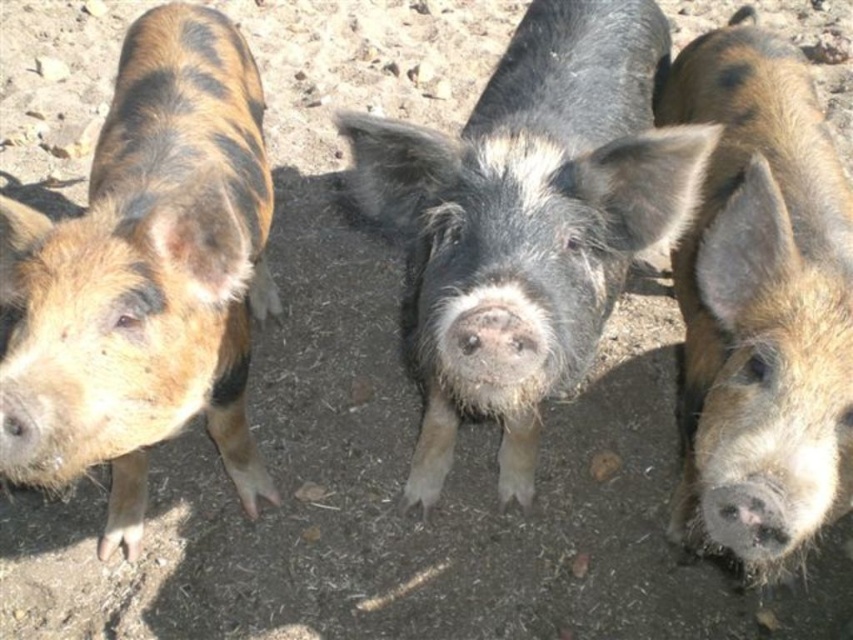
Question: Does black fuzzy pig at center appear on the right side of brown speckled pig at center?

Choices:
 (A) yes
 (B) no

Answer: (B)

Question: Does brown speckled fur at left appear on the left side of brown speckled pig at center?

Choices:
 (A) yes
 (B) no

Answer: (A)

Question: Which point is closer to the camera?

Choices:
 (A) black fuzzy pig at center
 (B) brown speckled pig at center

Answer: (A)

Question: Can you confirm if black fuzzy pig at center is wider than brown speckled fur at left?

Choices:
 (A) no
 (B) yes

Answer: (B)

Question: Which object is positioned closest to the brown speckled pig at center?

Choices:
 (A) brown speckled fur at left
 (B) black fuzzy pig at center

Answer: (B)

Question: Which point is farther from the camera taking this photo?

Choices:
 (A) (809, 513)
 (B) (28, 435)

Answer: (B)